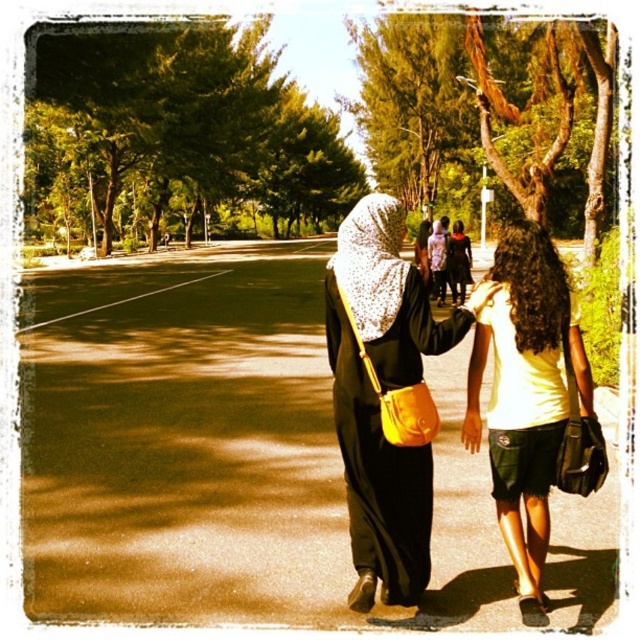
Question: Observing the image, what is the correct spatial positioning of matte yellow shirt at center in reference to white matte dress at center?

Choices:
 (A) right
 (B) left

Answer: (A)

Question: Which object is positioned closest to the white matte dress at center?

Choices:
 (A) matte yellow bag at center
 (B) matte yellow shirt at center

Answer: (B)

Question: Which object is the farthest from the white matte dress at center?

Choices:
 (A) matte yellow shirt at center
 (B) matte yellow bag at center

Answer: (B)

Question: Does matte yellow bag at center appear on the right side of matte yellow shirt at center?

Choices:
 (A) yes
 (B) no

Answer: (B)

Question: Does matte yellow bag at center have a greater width compared to white matte dress at center?

Choices:
 (A) yes
 (B) no

Answer: (A)

Question: Among these objects, which one is nearest to the camera?

Choices:
 (A) white matte dress at center
 (B) matte yellow shirt at center

Answer: (B)